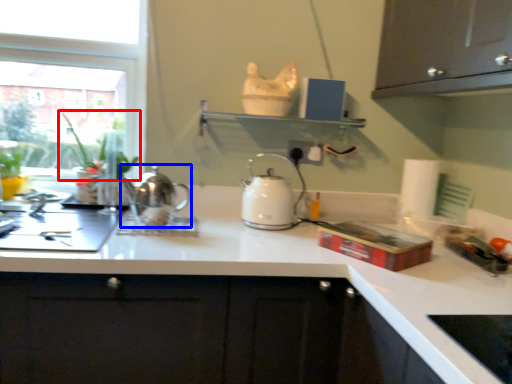
Question: Which of the following is the closest to the observer, plant (highlighted by a red box) or kettle (highlighted by a blue box)?

Choices:
 (A) plant
 (B) kettle

Answer: (B)